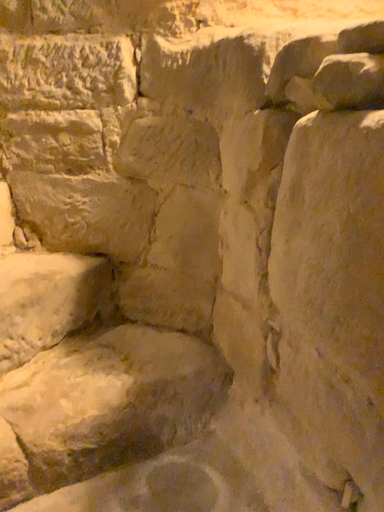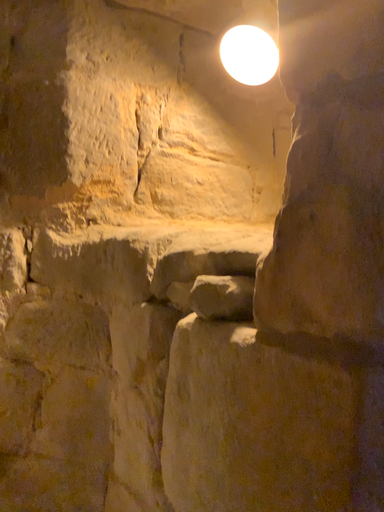
Question: How did the camera likely rotate when shooting the video?

Choices:
 (A) rotated upward
 (B) rotated downward

Answer: (A)